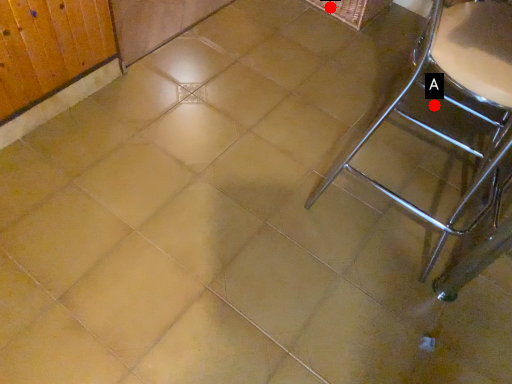
Question: Two points are circled on the image, labeled by A and B beside each circle. Which point is farther from the camera taking this photo?

Choices:
 (A) A is further
 (B) B is further

Answer: (B)